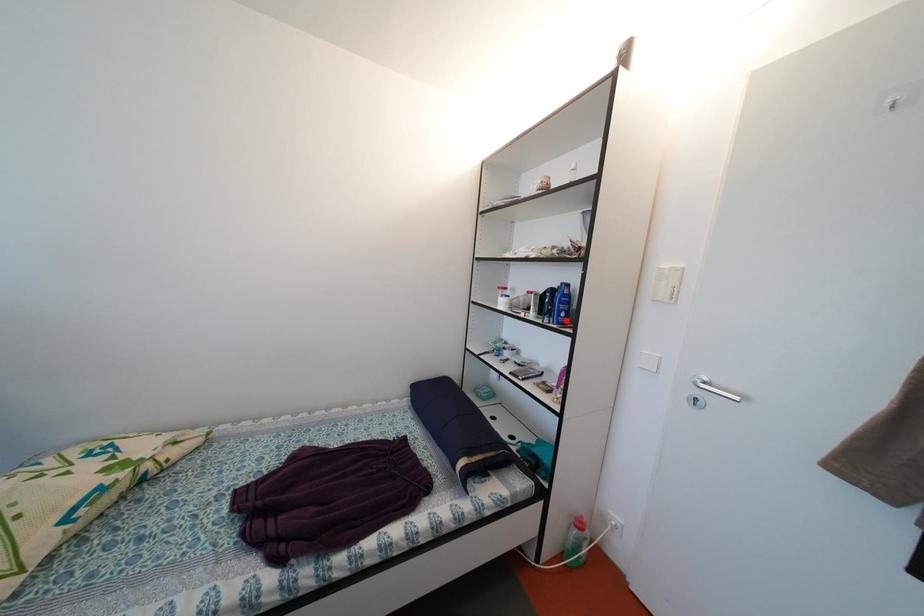
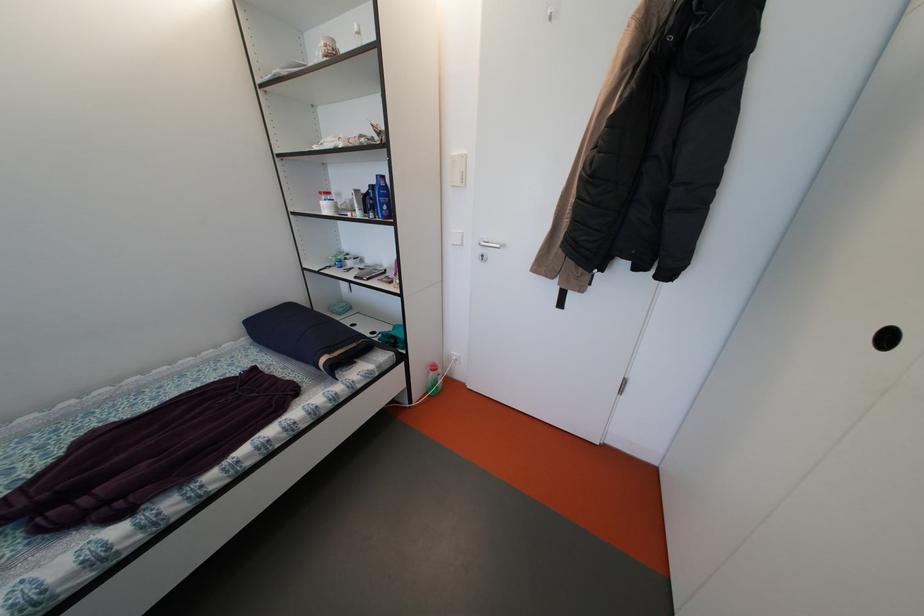
Question: I am providing you with two images of the same scene from different viewpoints. A red point is marked on the first image. Is the red point's position out of view in image 2?

Choices:
 (A) Yes
 (B) No

Answer: (B)